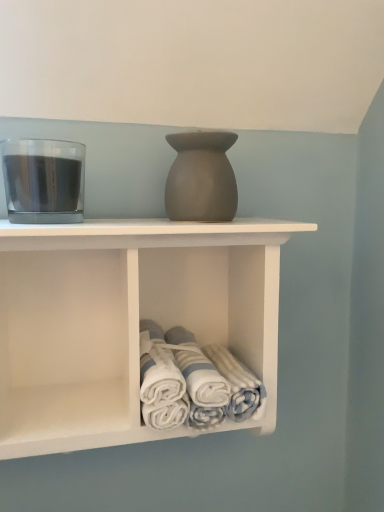
Question: From the image's perspective, is white matte towel rack at center located above or below transparent glass at left?

Choices:
 (A) below
 (B) above

Answer: (A)

Question: Considering the positions of white matte towel rack at center and transparent glass at left in the image, is white matte towel rack at center wider or thinner than transparent glass at left?

Choices:
 (A) thin
 (B) wide

Answer: (B)

Question: Based on their relative distances, which object is nearer to the white cotton towels at lower center?

Choices:
 (A) transparent glass at left
 (B) matte gray vase at center
 (C) white matte towel rack at center

Answer: (C)

Question: Which is farther from the transparent glass at left?

Choices:
 (A) white matte towel rack at center
 (B) white cotton towels at lower center
 (C) matte gray vase at center

Answer: (B)